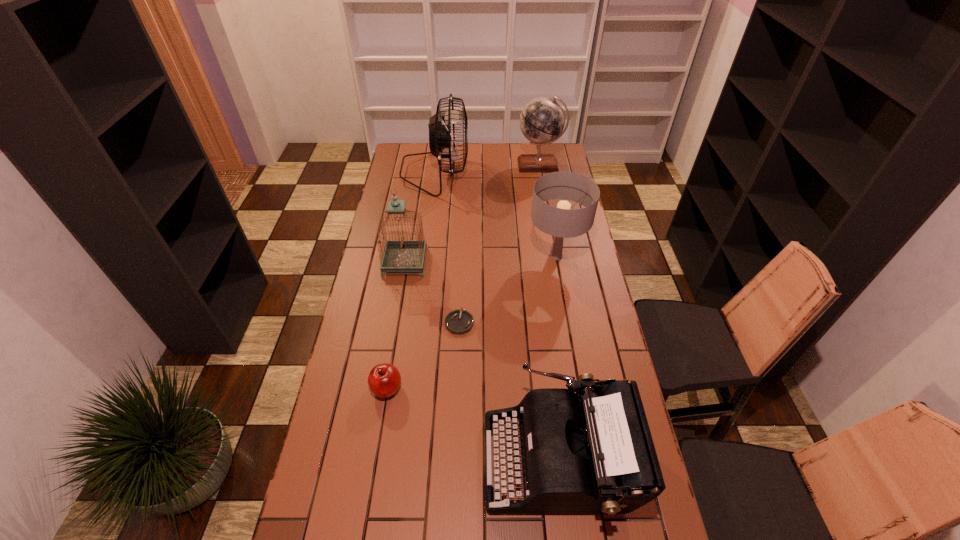
Identify the location of blank area located at the door of the birdcage. (453, 262).

The height and width of the screenshot is (540, 960). I want to click on free space located 0.200m on the front-facing side of the lampshade, so click(566, 316).

Where is `free point located 0.270m on the typing side of the third shortest object`? free point located 0.270m on the typing side of the third shortest object is located at coordinates (389, 458).

Find the location of a particular element. vacant space positioned 0.270m on the typing side of the third shortest object is located at coordinates (389, 458).

At what (x,y) coordinates should I click in order to perform the action: click on vacant space located on the typing side of the third shortest object. Please return your answer as a coordinate pair (x, y). Looking at the image, I should click on (421, 458).

I want to click on vacant space located on the back of the second shortest object, so click(400, 308).

Identify the location of vacant region located on the right of the shortest object. (511, 322).

This screenshot has width=960, height=540. Find the location of `fan that is at the far edge`. fan that is at the far edge is located at coordinates (441, 135).

The image size is (960, 540). What are the coordinates of `globe that is at the far edge` in the screenshot? It's located at (542, 120).

Locate an element on the screen. This screenshot has width=960, height=540. fan that is at the left edge is located at coordinates (441, 135).